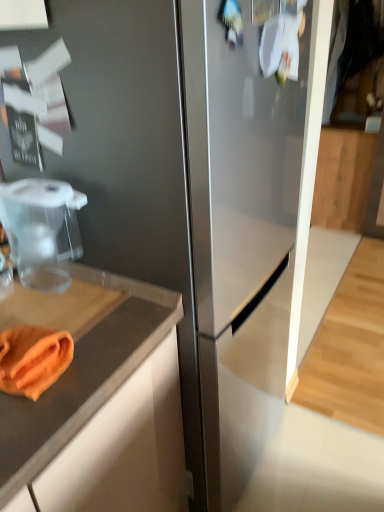
Identify the location of vacant space in transparent plastic food processor at left (from a real-world perspective). (56, 281).